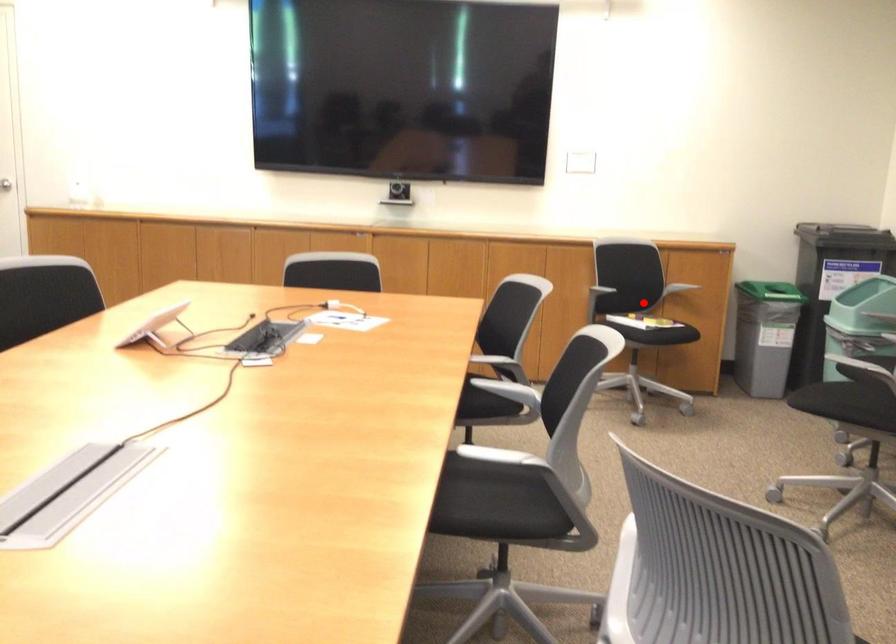
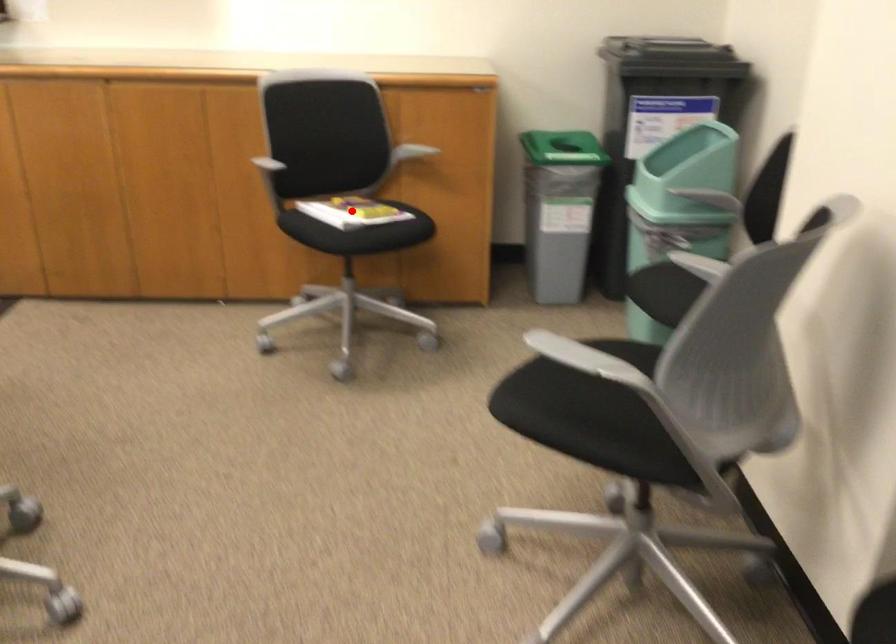
I am providing you with two images of the same scene from different viewpoints. A red point is marked on the first image and another point is marked on the second image. Is the red point in image1 aligned with the point shown in image2?

Yes